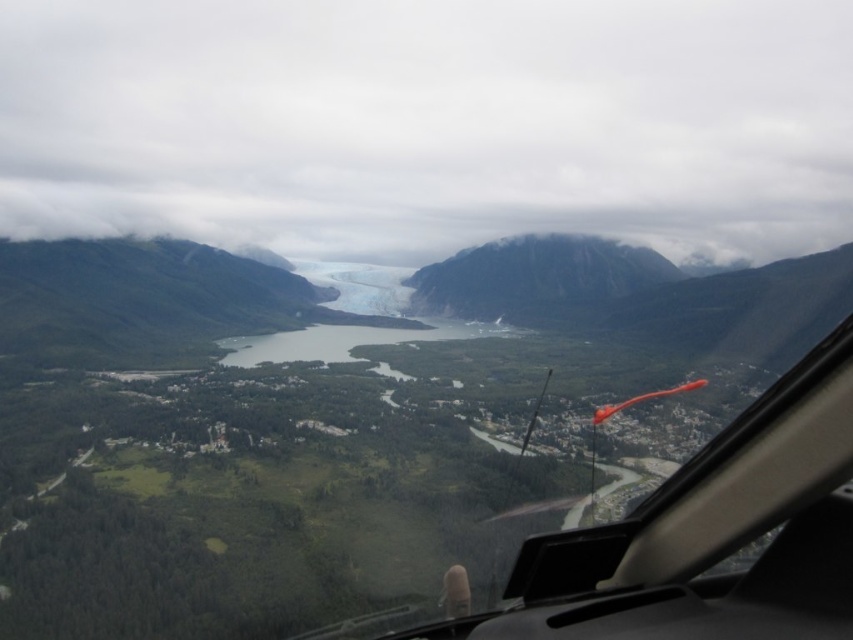
Does point (451, 275) come closer to viewer compared to point (439, 333)?

No, it is not.

Can you confirm if rugged granite mountain at center is positioned above gray/rocky lake at center?

Yes.

The width and height of the screenshot is (853, 640). What are the coordinates of `rugged granite mountain at center` in the screenshot? It's located at (535, 276).

Where is `rugged granite mountain at center`? This screenshot has width=853, height=640. rugged granite mountain at center is located at coordinates (535, 276).